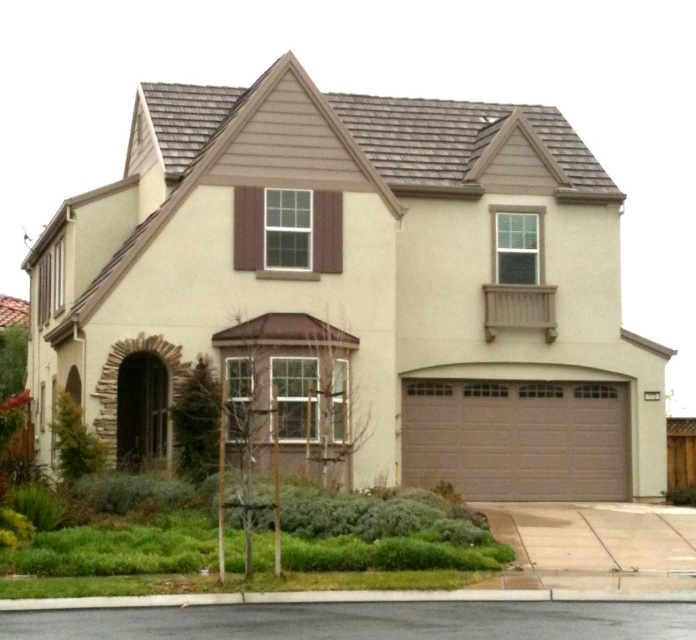
Does matte brown garage door at center lie behind brown textured garage door at center?

No.

Who is more forward, (x=152, y=99) or (x=537, y=451)?

Point (x=537, y=451) is more forward.

The image size is (696, 640). I want to click on matte brown garage door at center, so click(x=358, y=289).